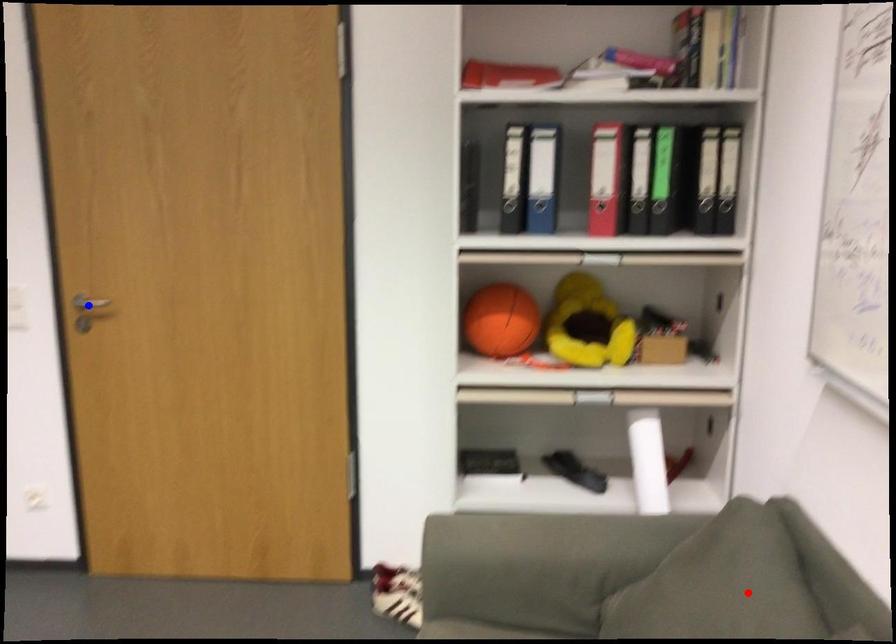
Question: Which of the two points in the image is closer to the camera?

Choices:
 (A) Blue point is closer.
 (B) Red point is closer.

Answer: (B)